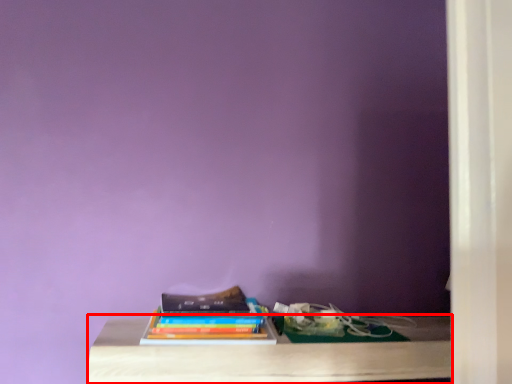
Question: Observing the image, what is the correct spatial positioning of table (annotated by the red box) in reference to book?

Choices:
 (A) left
 (B) right

Answer: (B)